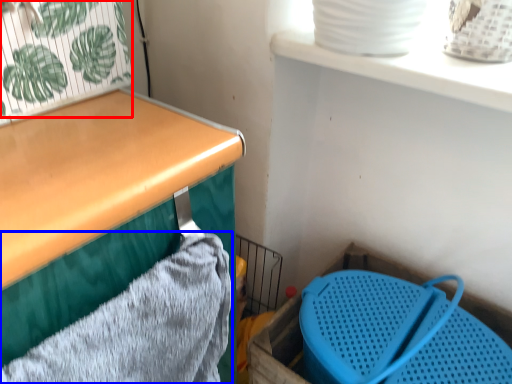
Question: Which object appears farthest to the camera in this image, plant (highlighted by a red box) or bath towel (highlighted by a blue box)?

Choices:
 (A) plant
 (B) bath towel

Answer: (A)